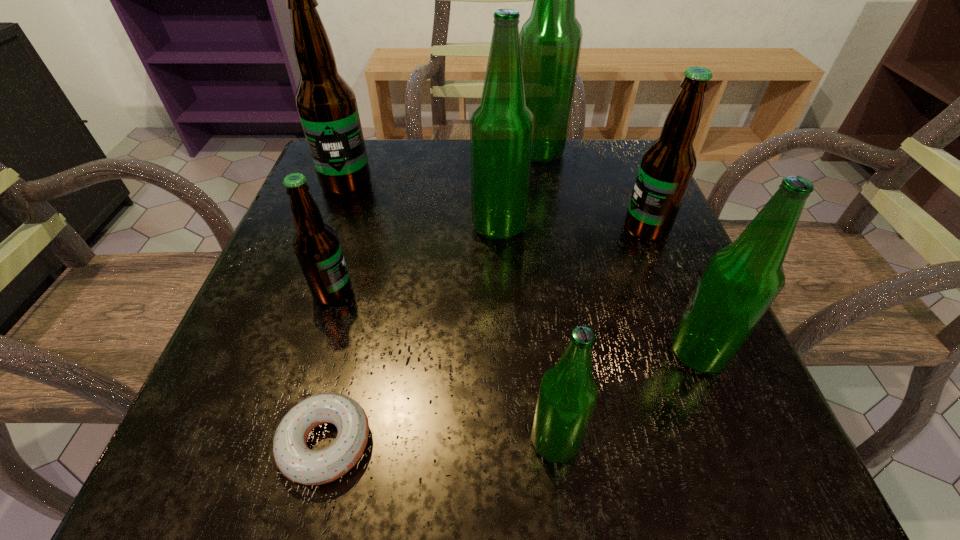
Where is `the fifth farthest object`? This screenshot has height=540, width=960. the fifth farthest object is located at coordinates (316, 245).

At what (x,y) coordinates should I click in order to perform the action: click on the nearest beer bottle. Please return your answer as a coordinate pair (x, y). This screenshot has height=540, width=960. Looking at the image, I should click on (x=567, y=397).

At what (x,y) coordinates should I click in order to perform the action: click on the smallest green beer bottle. Please return your answer as a coordinate pair (x, y). Looking at the image, I should click on (567, 397).

Where is `the shortest object`? The image size is (960, 540). the shortest object is located at coordinates (294, 459).

This screenshot has width=960, height=540. Find the location of `blank area located 0.400m on the label of the farthest object`. blank area located 0.400m on the label of the farthest object is located at coordinates (344, 152).

The height and width of the screenshot is (540, 960). What are the coordinates of `vacant region located on the label of the farthest object` in the screenshot? It's located at (437, 152).

You are a GUI agent. You are given a task and a screenshot of the screen. Output one action in this format:
    pyautogui.click(x=<x>, y=<y>)
    Task: Click on the free space located on the label of the farthest object
    
    Given the screenshot: What is the action you would take?
    pyautogui.click(x=420, y=152)

Find the location of `blank space located 0.240m on the label of the second biggest green beer bottle`. blank space located 0.240m on the label of the second biggest green beer bottle is located at coordinates (348, 227).

Identify the location of vacant space located on the label of the second biggest green beer bottle. (312, 227).

Locate an element on the screen. The image size is (960, 540). vacant space situated 0.130m on the label of the second biggest green beer bottle is located at coordinates (405, 227).